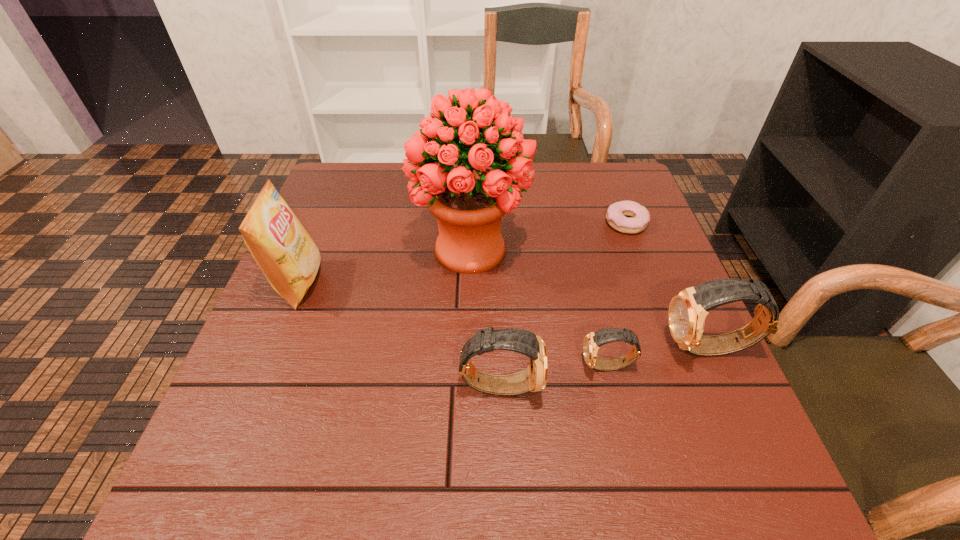
At what (x,y) coordinates should I click in order to perform the action: click on object located in the left edge section of the desktop. Please return your answer as a coordinate pair (x, y). Looking at the image, I should click on (288, 257).

Locate an element on the screen. The image size is (960, 540). doughnut at the right edge is located at coordinates (616, 213).

Find the location of a particular element. This screenshot has height=540, width=960. vacant space at the far edge of the desktop is located at coordinates (389, 168).

Where is `free space at the near edge of the desktop`? The width and height of the screenshot is (960, 540). free space at the near edge of the desktop is located at coordinates (395, 423).

Where is `vacant area at the left edge`? vacant area at the left edge is located at coordinates (280, 309).

Locate an element on the screen. free space at the far left corner of the desktop is located at coordinates tap(369, 171).

In the image, there is a desktop. At what (x,y) coordinates should I click in order to perform the action: click on vacant space at the near left corner. Please return your answer as a coordinate pair (x, y). The width and height of the screenshot is (960, 540). Looking at the image, I should click on (247, 423).

Where is `free space at the far right corner of the desktop`? free space at the far right corner of the desktop is located at coordinates (629, 191).

Image resolution: width=960 pixels, height=540 pixels. I want to click on vacant region at the near right corner of the desktop, so click(x=694, y=418).

Image resolution: width=960 pixels, height=540 pixels. What are the coordinates of `vacant area that lies between the doughnut and the second shortest object` in the screenshot? It's located at (617, 294).